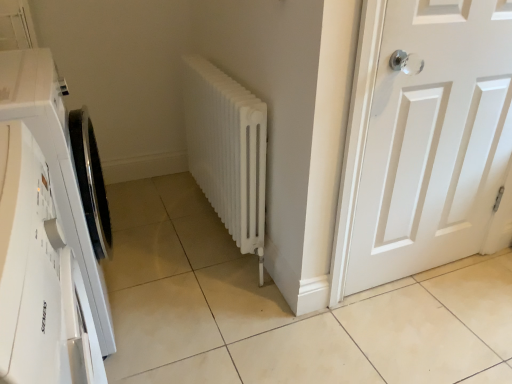
Question: Considering the relative sizes of white matte door at right and white matte radiator at center in the image provided, is white matte door at right taller than white matte radiator at center?

Choices:
 (A) yes
 (B) no

Answer: (A)

Question: From a real-world perspective, does white matte door at right sit lower than white matte radiator at center?

Choices:
 (A) no
 (B) yes

Answer: (A)

Question: Considering the relative sizes of white matte door at right and white matte radiator at center in the image provided, is white matte door at right wider than white matte radiator at center?

Choices:
 (A) yes
 (B) no

Answer: (B)

Question: Can you confirm if white matte door at right is bigger than white matte radiator at center?

Choices:
 (A) no
 (B) yes

Answer: (A)

Question: Does white matte door at right come in front of white matte radiator at center?

Choices:
 (A) yes
 (B) no

Answer: (A)

Question: From a real-world perspective, is white matte door at right over white matte radiator at center?

Choices:
 (A) no
 (B) yes

Answer: (B)

Question: Would you say white matte/waterproof washing machine at left is part of white matte radiator at center's contents?

Choices:
 (A) yes
 (B) no

Answer: (B)

Question: Does white matte radiator at center turn towards white matte/waterproof washing machine at left?

Choices:
 (A) no
 (B) yes

Answer: (A)

Question: Is white matte radiator at center not within white matte/waterproof washing machine at left?

Choices:
 (A) no
 (B) yes

Answer: (B)

Question: Is white matte radiator at center to the left of white matte/waterproof washing machine at left from the viewer's perspective?

Choices:
 (A) yes
 (B) no

Answer: (B)

Question: Can you confirm if white matte radiator at center is taller than white matte/waterproof washing machine at left?

Choices:
 (A) yes
 (B) no

Answer: (B)

Question: Considering the relative sizes of white matte radiator at center and white matte/waterproof washing machine at left in the image provided, is white matte radiator at center thinner than white matte/waterproof washing machine at left?

Choices:
 (A) no
 (B) yes

Answer: (B)

Question: From the image's perspective, is white matte/waterproof washing machine at left below white matte radiator at center?

Choices:
 (A) no
 (B) yes

Answer: (B)